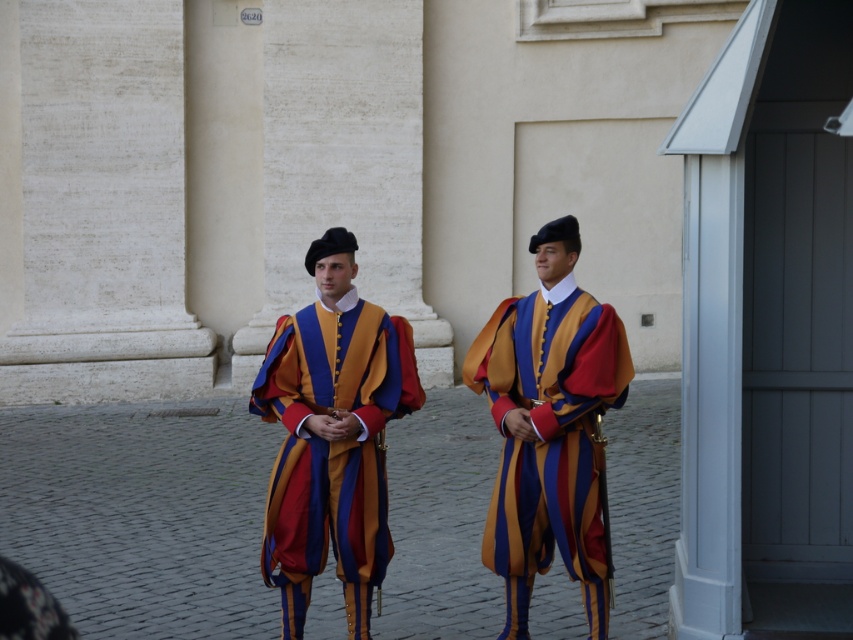
You are a photographer positioned at the origin point of the coordinate system. You need to capture a photo of the matte velvet uniform at center. What are the coordinates where you should aim your camera?

The coordinates to aim your camera are at point (331, 436), which is where the matte velvet uniform at center is located.

You are standing in front of the building and want to determine which of the two points, point (352, 630) or point (596, 355), is closer to you. Based on the scene description, which point is nearer?

Point (352, 630) is further to the camera than point (596, 355), so the point closer to you is point (596, 355).